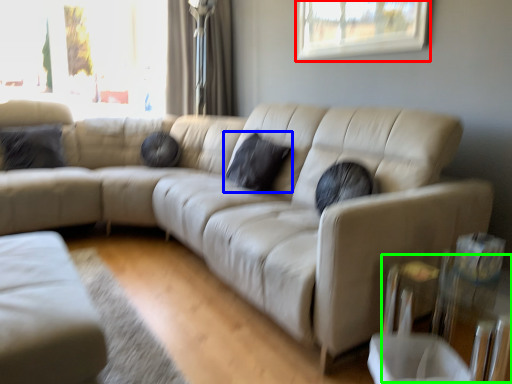
Question: Which object is positioned closest to window (highlighted by a red box)? Select from pillow (highlighted by a blue box) and glass table (highlighted by a green box).

Choices:
 (A) pillow
 (B) glass table

Answer: (A)